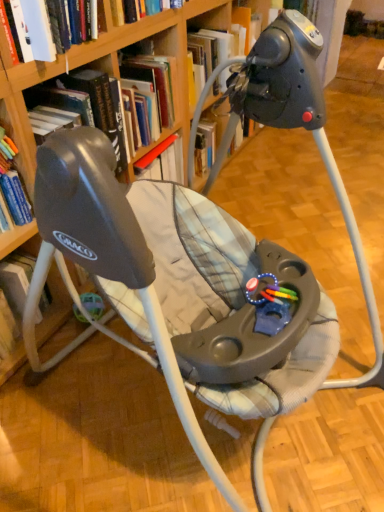
Question: Can you confirm if wooden bookcase at upper center is taller than rubberized plastic teething toy at center?

Choices:
 (A) yes
 (B) no

Answer: (A)

Question: Is the position of wooden bookcase at upper center less distant than that of rubberized plastic teething toy at center?

Choices:
 (A) yes
 (B) no

Answer: (A)

Question: From a real-world perspective, is wooden bookcase at upper center below rubberized plastic teething toy at center?

Choices:
 (A) yes
 (B) no

Answer: (B)

Question: Is wooden bookcase at upper center aimed at rubberized plastic teething toy at center?

Choices:
 (A) no
 (B) yes

Answer: (B)

Question: Can you confirm if wooden bookcase at upper center is positioned to the left of rubberized plastic teething toy at center?

Choices:
 (A) yes
 (B) no

Answer: (A)

Question: From the image's perspective, is hardcover book at upper left, acting as the 1th book starting from the bottom, positioned above or below wooden bookcase at upper center?

Choices:
 (A) below
 (B) above

Answer: (B)

Question: Is hardcover book at upper left, which appears as the second book when viewed from the top, inside or outside of wooden bookcase at upper center?

Choices:
 (A) inside
 (B) outside

Answer: (B)

Question: Is point (84, 117) positioned closer to the camera than point (236, 13)?

Choices:
 (A) closer
 (B) farther

Answer: (A)

Question: Considering the relative positions of hardcover book at upper left, which appears as the second book when viewed from the top, and wooden bookcase at upper center in the image provided, is hardcover book at upper left, which appears as the second book when viewed from the top, to the left or to the right of wooden bookcase at upper center?

Choices:
 (A) left
 (B) right

Answer: (A)

Question: From the image's perspective, is rubberized plastic teething toy at center located above or below wooden bookcase at upper center?

Choices:
 (A) above
 (B) below

Answer: (B)

Question: Is point (288, 308) positioned closer to the camera than point (137, 27)?

Choices:
 (A) farther
 (B) closer

Answer: (B)

Question: In the image, is rubberized plastic teething toy at center positioned in front of or behind wooden bookcase at upper center?

Choices:
 (A) behind
 (B) front

Answer: (A)

Question: Is rubberized plastic teething toy at center wider or thinner than wooden bookcase at upper center?

Choices:
 (A) wide
 (B) thin

Answer: (B)

Question: Is point (41, 93) closer or farther from the camera than point (281, 296)?

Choices:
 (A) closer
 (B) farther

Answer: (B)

Question: From a real-world perspective, relative to rubberized plastic teething toy at center, is hardcover book at upper left, acting as the 1th book starting from the bottom, vertically above or below?

Choices:
 (A) below
 (B) above

Answer: (B)